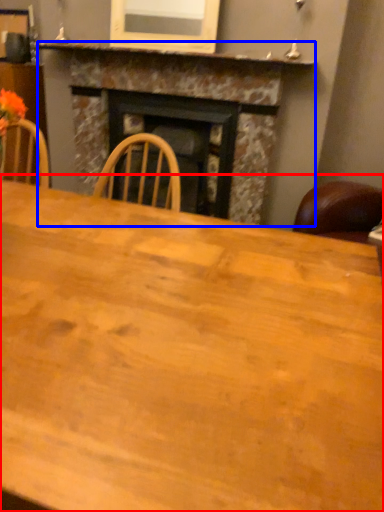
Question: Which of the following is the closest to the observer, table (highlighted by a red box) or fireplace (highlighted by a blue box)?

Choices:
 (A) table
 (B) fireplace

Answer: (A)